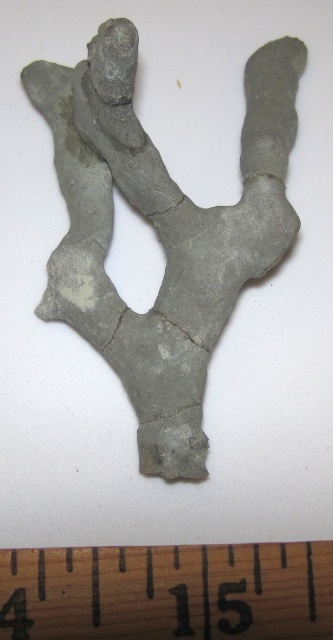
Where is the gray clay sculpture at center located in the image?

The gray clay sculpture at center is located at point [161,230].

You are an archaeologist examining the gray clay sculpture at center and the wooden ruler at bottom. Which object is closer to you?

The gray clay sculpture at center is closer to you since the wooden ruler at bottom is behind it.